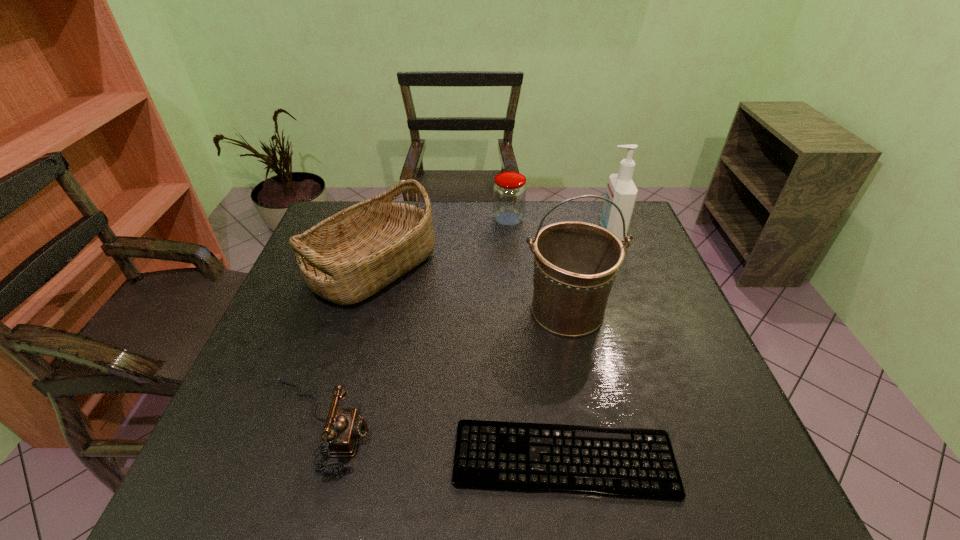
Locate an element on the screen. The image size is (960, 540). free space located 0.350m on the front label of the cleansing agent is located at coordinates (491, 232).

You are a GUI agent. You are given a task and a screenshot of the screen. Output one action in this format:
    pyautogui.click(x=<x>, y=<y>)
    Task: Click on the blank space located 0.120m on the right of the basket
    The image size is (960, 540).
    Given the screenshot: What is the action you would take?
    pyautogui.click(x=475, y=266)

Where is `vacant space located on the right of the jar`? The width and height of the screenshot is (960, 540). vacant space located on the right of the jar is located at coordinates (608, 219).

Where is `free space located on the dial of the second shortest object`? Image resolution: width=960 pixels, height=540 pixels. free space located on the dial of the second shortest object is located at coordinates (469, 427).

At what (x,y) coordinates should I click in order to perform the action: click on vacant point located 0.390m on the left of the shortest object. Please return your answer as a coordinate pair (x, y). The width and height of the screenshot is (960, 540). Looking at the image, I should click on (251, 459).

At what (x,y) coordinates should I click in order to perform the action: click on cleansing agent at the far edge. Please return your answer as a coordinate pair (x, y). This screenshot has width=960, height=540. Looking at the image, I should click on (621, 190).

Locate an element on the screen. This screenshot has width=960, height=540. basket located at the far edge is located at coordinates (348, 257).

I want to click on jar at the far edge, so click(509, 191).

Image resolution: width=960 pixels, height=540 pixels. I want to click on telephone that is positioned at the near edge, so click(x=344, y=426).

You are a GUI agent. You are given a task and a screenshot of the screen. Output one action in this format:
    pyautogui.click(x=<x>, y=<y>)
    Task: Click on the computer keyboard that is at the near edge
    Image resolution: width=960 pixels, height=540 pixels.
    Given the screenshot: What is the action you would take?
    pyautogui.click(x=630, y=463)